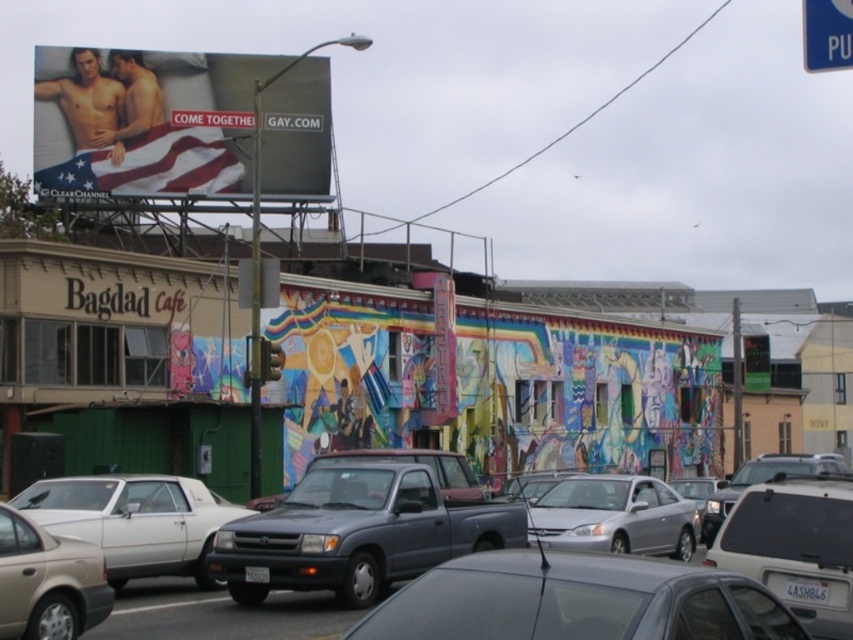
You are planning to set up a temporary food stall between the american flag fabric bed at upper left and the white glossy sedan at lower left. The stall requires a minimum space of 15 meters between these two objects to ensure safety. Based on the scene description, is the available space sufficient?

The american flag fabric bed at upper left and white glossy sedan at lower left are 17.64 meters apart from each other, which is more than the required 15 meters, so the space is sufficient.

You are a photographer planning to take a photo of the Bagdad Cafe mural. You have two items in your scene, the american flag fabric bed at upper left and the silver metallic sedan at center. Which object should you position closer to the camera to ensure both are in focus without adjusting the aperture? Explain your reasoning.

The american flag fabric bed at upper left is larger in size than the silver metallic sedan at center. To keep both in focus, position the larger object closer to the camera because larger objects can be in focus at closer distances without requiring a smaller aperture.

You are standing at the center of the street in front of the building with the Bagdad Cafe mural. You need to locate the american flag fabric bed at upper left. Which direction should you look to find it?

The american flag fabric bed at upper left is located at point (144, 122), which is to the upper left direction from your current position at the center of the street.